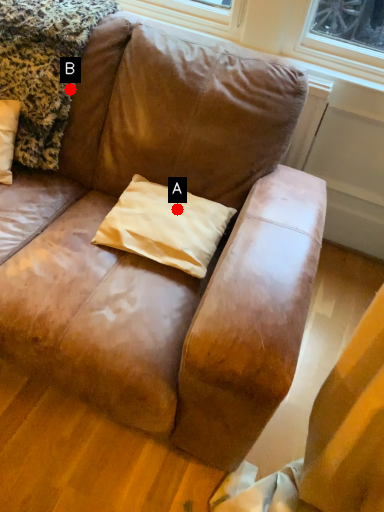
Question: Two points are circled on the image, labeled by A and B beside each circle. Which point is closer to the camera?

Choices:
 (A) A is closer
 (B) B is closer

Answer: (A)